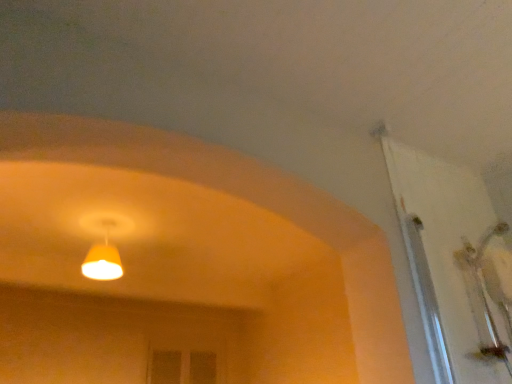
Question: Should I look upward or downward to see white glossy door at upper right?

Choices:
 (A) down
 (B) up

Answer: (A)

Question: Does yellow matte lampshade at upper center lie in front of white glossy door at upper right?

Choices:
 (A) no
 (B) yes

Answer: (A)

Question: Does yellow matte lampshade at upper center have a greater width compared to white glossy door at upper right?

Choices:
 (A) yes
 (B) no

Answer: (B)

Question: From the image's perspective, is yellow matte lampshade at upper center over white glossy door at upper right?

Choices:
 (A) yes
 (B) no

Answer: (B)

Question: Is yellow matte lampshade at upper center at the left side of white glossy door at upper right?

Choices:
 (A) yes
 (B) no

Answer: (A)

Question: Is yellow matte lampshade at upper center facing away from white glossy door at upper right?

Choices:
 (A) yes
 (B) no

Answer: (B)

Question: From the image's perspective, does yellow matte lampshade at upper center appear lower than white glossy door at upper right?

Choices:
 (A) yes
 (B) no

Answer: (A)

Question: Is white glossy door at upper right bigger than yellow matte lampshade at upper center?

Choices:
 (A) no
 (B) yes

Answer: (B)

Question: Is the position of white glossy door at upper right less distant than that of yellow matte lampshade at upper center?

Choices:
 (A) no
 (B) yes

Answer: (B)

Question: Considering the relative sizes of white glossy door at upper right and yellow matte lampshade at upper center in the image provided, is white glossy door at upper right wider than yellow matte lampshade at upper center?

Choices:
 (A) no
 (B) yes

Answer: (B)

Question: From the image's perspective, is white glossy door at upper right over yellow matte lampshade at upper center?

Choices:
 (A) yes
 (B) no

Answer: (A)

Question: Are white glossy door at upper right and yellow matte lampshade at upper center far apart?

Choices:
 (A) yes
 (B) no

Answer: (A)

Question: Is white glossy door at upper right further to camera compared to yellow matte lampshade at upper center?

Choices:
 (A) no
 (B) yes

Answer: (A)

Question: From a real-world perspective, is yellow matte lampshade at upper center positioned above or below white glossy door at upper right?

Choices:
 (A) above
 (B) below

Answer: (A)